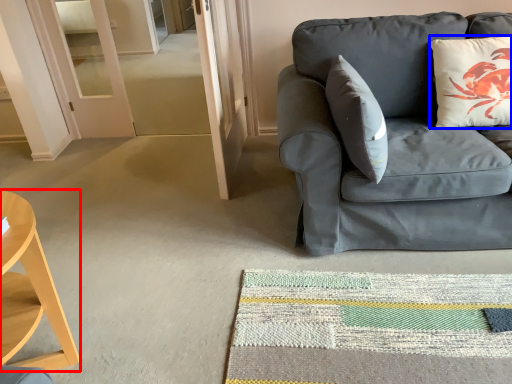
Question: Which of the following is the closest to the observer, desk (highlighted by a red box) or pillow (highlighted by a blue box)?

Choices:
 (A) desk
 (B) pillow

Answer: (A)